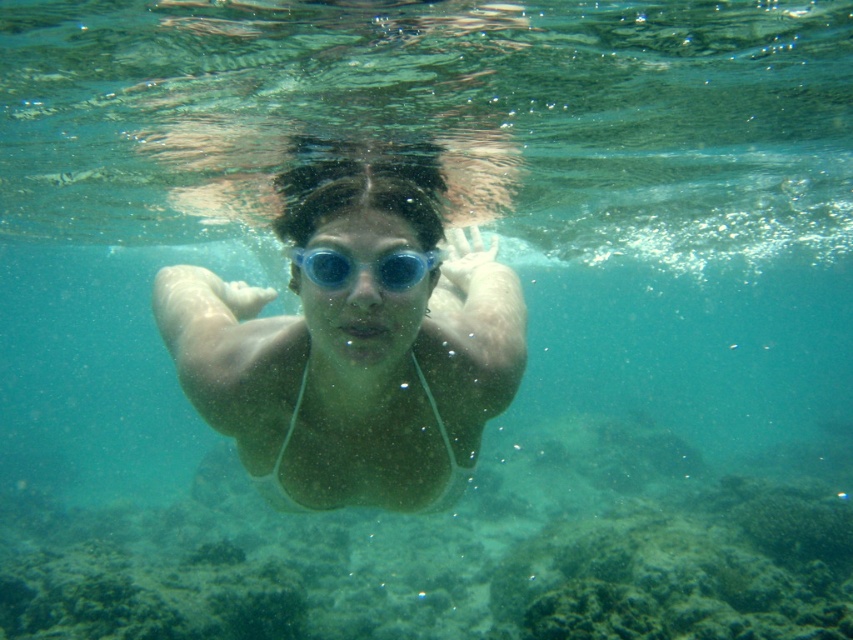
You are a lifeguard trying to locate two pairs of goggles floating in the water. The swimmer is wearing the matte blue goggles at center and dropped the blue translucent goggles at center. How far apart are the two pairs of goggles?

The matte blue goggles at center is 33.35 centimeters from blue translucent goggles at center.